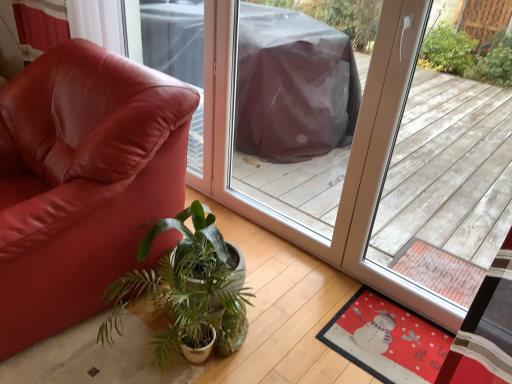
At what (x,y) coordinates should I click in order to perform the action: click on free location above red felt mat at lower right (from a real-world perspective). Please return your answer as a coordinate pair (x, y). Looking at the image, I should click on (398, 343).